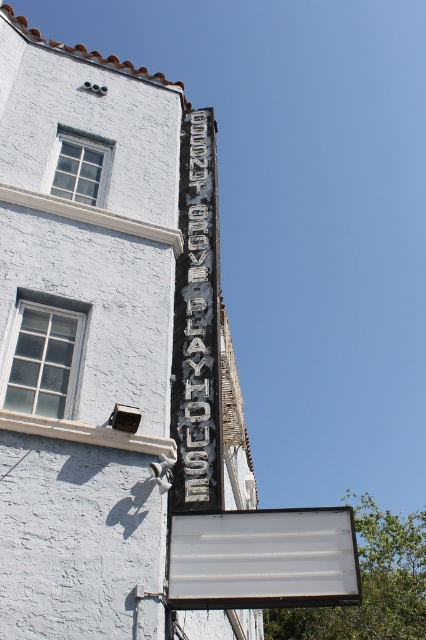
You are standing in front of the Coconut Grove Playhouse building. There is a point marked at coordinates [264,557]. What object is located at this point?

The point at coordinates [264,557] indicates the white matte sign at center.

You are standing in front of the Coconut Grove Playhouse and want to take a photo that includes both the sign and the security camera. The sign is located at point (324, 596) and the security camera is at point (180, 209). Which object should you focus on first to ensure both are in sharp focus?

You should focus on the point closer to the viewer, which is point (324, 596), since it is closer and focusing on it will help ensure both points are in focus due to the depth of field.

You are standing in front of the Coconut Grove Playhouse. You notice two signs on the building. The first is a white matte sign at center, and the second is a black metal sign at upper center. Which of these two signs is taller?

The white matte sign at center is taller than the black metal sign at upper center.